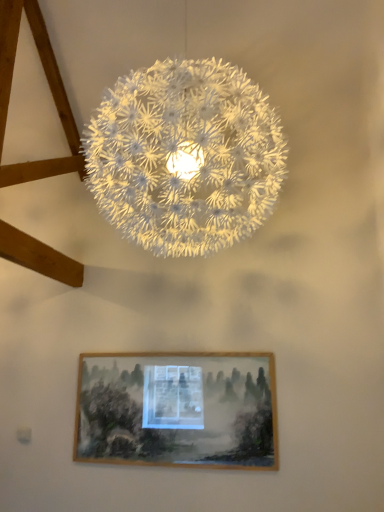
What is the approximate width of wooden picture frame at lower center?

wooden picture frame at lower center is 2.71 inches in width.

Looking at this image, in order to face wooden picture frame at lower center, should I rotate leftwards or rightwards?

You should look left and rotate roughly 2.353 degrees.

Locate an element on the screen. The height and width of the screenshot is (512, 384). wooden picture frame at lower center is located at coordinates (177, 410).

What do you see at coordinates (177, 410) in the screenshot?
I see `wooden picture frame at lower center` at bounding box center [177, 410].

The width and height of the screenshot is (384, 512). Describe the element at coordinates (185, 156) in the screenshot. I see `white textured sphere at center` at that location.

The image size is (384, 512). What are the coordinates of `white textured sphere at center` in the screenshot? It's located at (185, 156).

Find the location of a particular element. The image size is (384, 512). wooden picture frame at lower center is located at coordinates (177, 410).

Is white textured sphere at center to the right of wooden picture frame at lower center from the viewer's perspective?

Correct, you'll find white textured sphere at center to the right of wooden picture frame at lower center.

Which object is more forward, white textured sphere at center or wooden picture frame at lower center?

white textured sphere at center is more forward.

Is point (226, 95) positioned behind point (95, 435)?

No, (226, 95) is in front of (95, 435).

From the image's perspective, is white textured sphere at center below wooden picture frame at lower center?

Actually, white textured sphere at center appears above wooden picture frame at lower center in the image.

From a real-world perspective, which is physically below, white textured sphere at center or wooden picture frame at lower center?

wooden picture frame at lower center is physically lower.

Looking at this image, in terms of width, does white textured sphere at center look wider or thinner when compared to wooden picture frame at lower center?

In the image, white textured sphere at center appears to be wider than wooden picture frame at lower center.

Which of these two, white textured sphere at center or wooden picture frame at lower center, stands taller?

With more height is white textured sphere at center.

Based on their sizes in the image, would you say white textured sphere at center is bigger or smaller than wooden picture frame at lower center?

Considering their sizes, white textured sphere at center takes up more space than wooden picture frame at lower center.

Would you say wooden picture frame at lower center is part of white textured sphere at center's contents?

No, wooden picture frame at lower center is not a part of white textured sphere at center.

Are white textured sphere at center and wooden picture frame at lower center far apart?

That's right, there is a large distance between white textured sphere at center and wooden picture frame at lower center.

Is white textured sphere at center oriented towards wooden picture frame at lower center?

No, white textured sphere at center is not turned towards wooden picture frame at lower center.

How many degrees apart are the facing directions of white textured sphere at center and wooden picture frame at lower center?

0.635 degrees separate the facing orientations of white textured sphere at center and wooden picture frame at lower center.

How distant is white textured sphere at center from wooden picture frame at lower center?

white textured sphere at center and wooden picture frame at lower center are 4.73 feet apart.

Where is `picture frame behind the white textured sphere at center`? picture frame behind the white textured sphere at center is located at coordinates (177, 410).

Is wooden picture frame at lower center to the right of white textured sphere at center from the viewer's perspective?

In fact, wooden picture frame at lower center is to the left of white textured sphere at center.

Considering the relative positions of wooden picture frame at lower center and white textured sphere at center in the image provided, is wooden picture frame at lower center in front of white textured sphere at center?

No, wooden picture frame at lower center is behind white textured sphere at center.

Which point is more distant from viewer, (91, 438) or (209, 231)?

The point (91, 438) is farther.

From the image's perspective, would you say wooden picture frame at lower center is positioned over white textured sphere at center?

No, from the image's perspective, wooden picture frame at lower center is not above white textured sphere at center.

From a real-world perspective, does wooden picture frame at lower center sit lower than white textured sphere at center?

Yes, from a real-world perspective, wooden picture frame at lower center is below white textured sphere at center.

Is wooden picture frame at lower center wider than white textured sphere at center?

Incorrect, the width of wooden picture frame at lower center does not surpass that of white textured sphere at center.

Between wooden picture frame at lower center and white textured sphere at center, which one has less height?

wooden picture frame at lower center is shorter.

Does wooden picture frame at lower center have a smaller size compared to white textured sphere at center?

Yes, wooden picture frame at lower center is smaller than white textured sphere at center.

Would you say wooden picture frame at lower center is inside or outside white textured sphere at center?

wooden picture frame at lower center exists outside the volume of white textured sphere at center.

Is wooden picture frame at lower center directly adjacent to white textured sphere at center?

No, wooden picture frame at lower center is not next to white textured sphere at center.

Is wooden picture frame at lower center looking in the opposite direction of white textured sphere at center?

No.

Can you tell me how much wooden picture frame at lower center and white textured sphere at center differ in facing direction?

They differ by 0.635 degrees in their facing directions.

Where is `lamp in front of the wooden picture frame at lower center`? lamp in front of the wooden picture frame at lower center is located at coordinates (185, 156).

What are the coordinates of `lamp above the wooden picture frame at lower center (from a real-world perspective)` in the screenshot? It's located at (185, 156).

Locate an element on the screen. The width and height of the screenshot is (384, 512). picture frame below the white textured sphere at center (from a real-world perspective) is located at coordinates (177, 410).